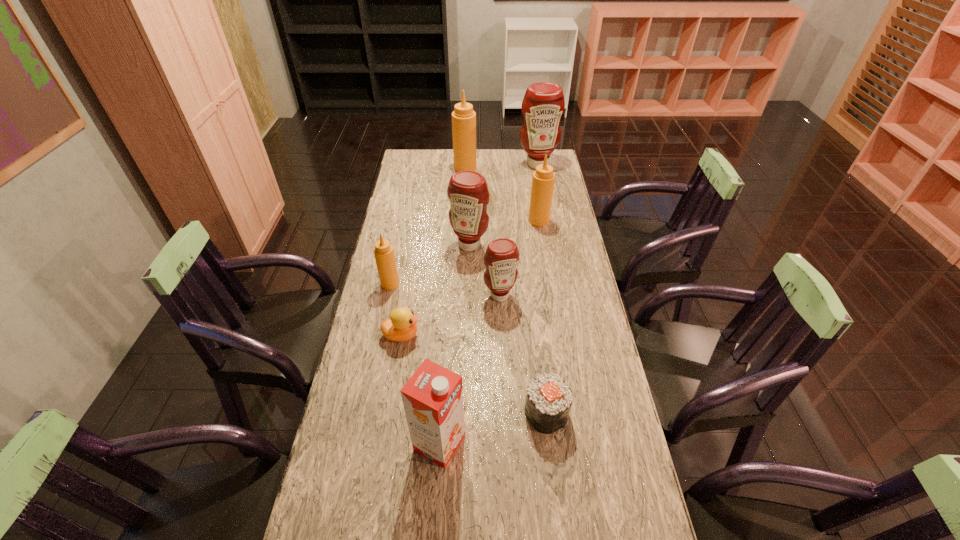
Identify the location of object identified as the eighth closest to the biggest tan condiment. (432, 398).

Identify the location of the sixth closest object to the smallest tan condiment. 548,401.

The image size is (960, 540). Identify the location of condiment that stands as the fifth closest to the nearest red condiment. (543, 104).

Locate an element on the screen. The image size is (960, 540). condiment that is the second nearest to the sushi is located at coordinates (384, 255).

Where is `red condiment that stands as the second closest to the nearest red condiment`? red condiment that stands as the second closest to the nearest red condiment is located at coordinates (543, 104).

Where is `red condiment that is the closest to the rightmost tan condiment`? This screenshot has height=540, width=960. red condiment that is the closest to the rightmost tan condiment is located at coordinates (467, 191).

Identify the location of the closest tan condiment relative to the second farthest tan condiment. (463, 117).

The height and width of the screenshot is (540, 960). I want to click on the second closest tan condiment to the second smallest tan condiment, so click(384, 255).

Find the location of a particular element. vacant area that satisfies the following two spatial constraints: 1. on the face of the duckling; 2. on the right side of the sushi is located at coordinates (389, 413).